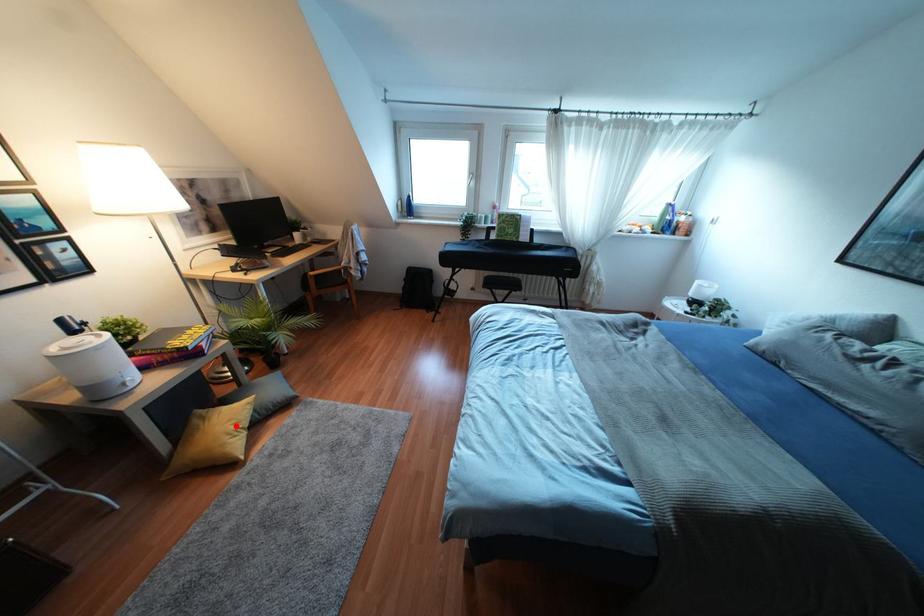
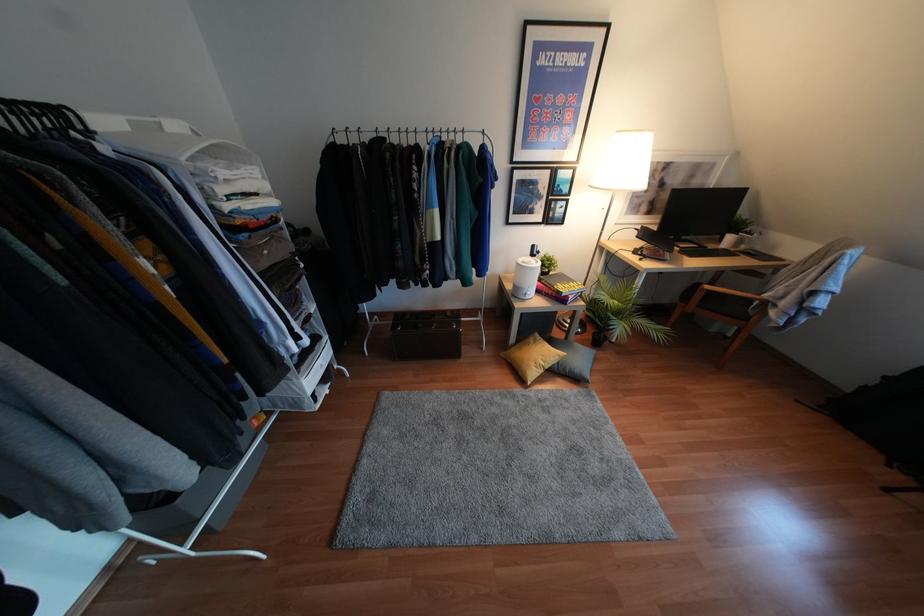
Question: A red point is marked in image1. In image2, is the corresponding 3D point closer to the camera or farther? Reply with the corresponding letter.

Choices:
 (A) The corresponding 3D point is closer.
 (B) The corresponding 3D point is farther.

Answer: (B)